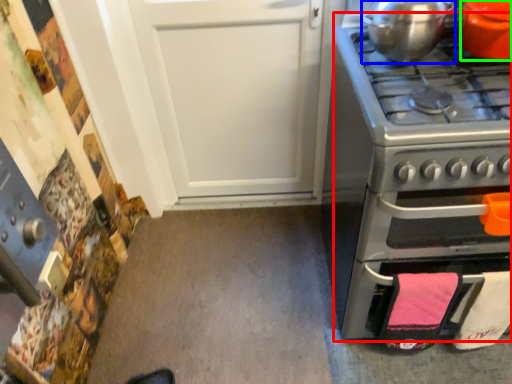
Question: Which object is the farthest from oven (highlighted by a red box)? Choose among these: kitchen appliance (highlighted by a blue box) or kitchen appliance (highlighted by a green box).

Choices:
 (A) kitchen appliance
 (B) kitchen appliance

Answer: (B)